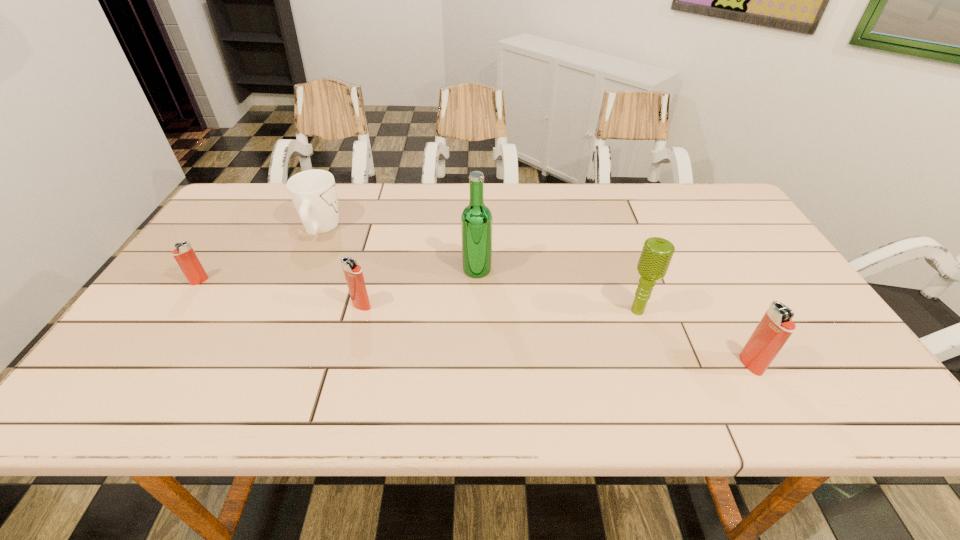
Where is `the shortest object`? The image size is (960, 540). the shortest object is located at coordinates (184, 254).

Where is `the farthest igniter`? the farthest igniter is located at coordinates (184, 254).

The width and height of the screenshot is (960, 540). In order to click on the second shortest igniter in this screenshot , I will do `click(353, 273)`.

Identify the location of the second nearest igniter. (353, 273).

The image size is (960, 540). Identify the location of the rightmost igniter. (776, 326).

Locate an element on the screen. The image size is (960, 540). the nearest object is located at coordinates (776, 326).

What are the coordinates of `the farthest object` in the screenshot? It's located at tap(313, 192).

Image resolution: width=960 pixels, height=540 pixels. I want to click on mug, so click(313, 192).

Where is `the fifth shortest object`? This screenshot has width=960, height=540. the fifth shortest object is located at coordinates (656, 255).

Find the location of a particular element. This screenshot has height=540, width=960. the fifth object from left to right is located at coordinates (656, 255).